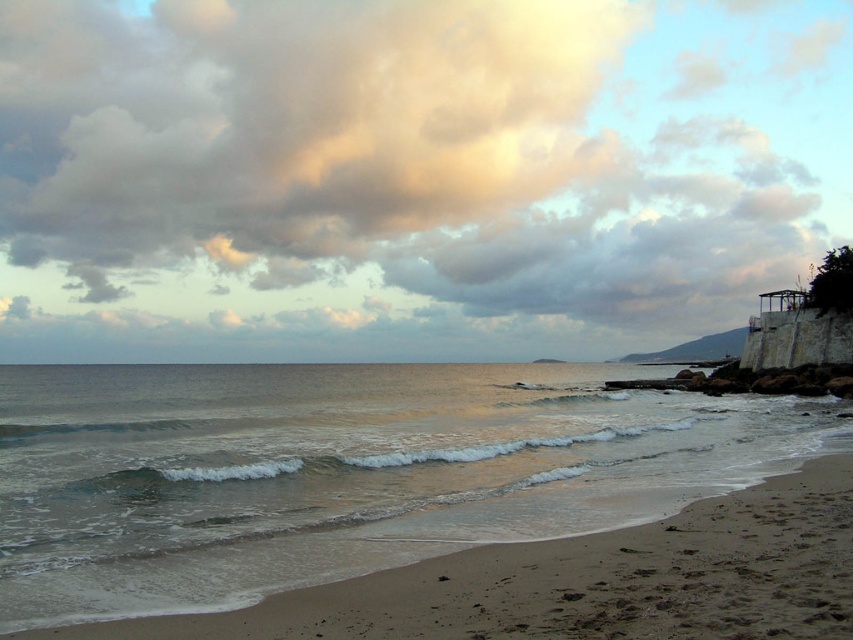
You are standing on the sandy beach at lower left and looking up at the cloudy sky at upper center. Which object is higher in the scene?

The cloudy sky at upper center is higher than the sandy beach at lower left.